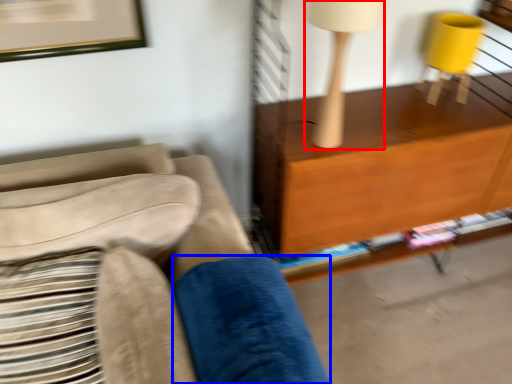
Question: Which object appears farthest to the camera in this image, table lamp (highlighted by a red box) or pillow (highlighted by a blue box)?

Choices:
 (A) table lamp
 (B) pillow

Answer: (A)